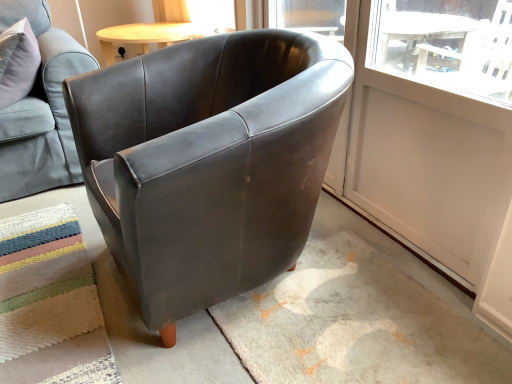
Image resolution: width=512 pixels, height=384 pixels. I want to click on empty space that is ontop of multicolored woven mat at lower left (from a real-world perspective), so click(41, 292).